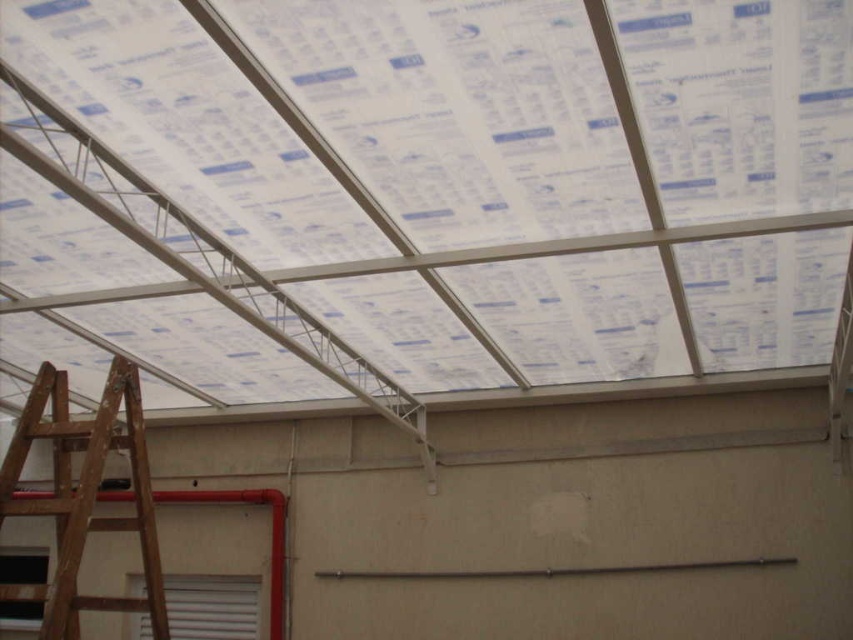
Question: Does transparent plastic roof at center appear under wooden ladder at lower left?

Choices:
 (A) yes
 (B) no

Answer: (B)

Question: Is transparent plastic roof at center to the right of wooden ladder at lower left from the viewer's perspective?

Choices:
 (A) yes
 (B) no

Answer: (A)

Question: Which of the following is the farthest from the observer?

Choices:
 (A) transparent plastic roof at center
 (B) wooden ladder at lower left

Answer: (A)

Question: Which object appears closest to the camera in this image?

Choices:
 (A) wooden ladder at lower left
 (B) transparent plastic roof at center

Answer: (A)

Question: Which point is farther from the camera taking this photo?

Choices:
 (A) (53, 481)
 (B) (851, 202)

Answer: (B)

Question: Does transparent plastic roof at center have a greater width compared to wooden ladder at lower left?

Choices:
 (A) no
 (B) yes

Answer: (B)